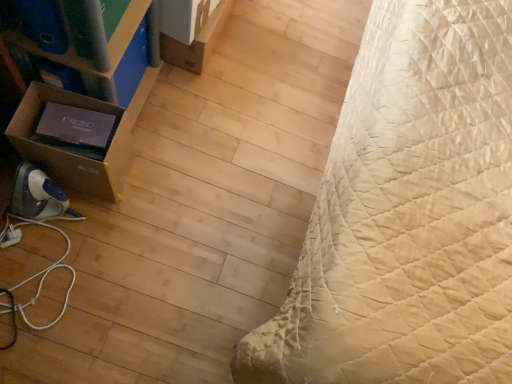
At what (x,y) coordinates should I click in order to perform the action: click on empty space that is to the right of brown cardboard box at left, placed as the second cardboard box when sorted from back to front. Please return your answer as a coordinate pair (x, y). The image size is (512, 384). Looking at the image, I should click on (151, 198).